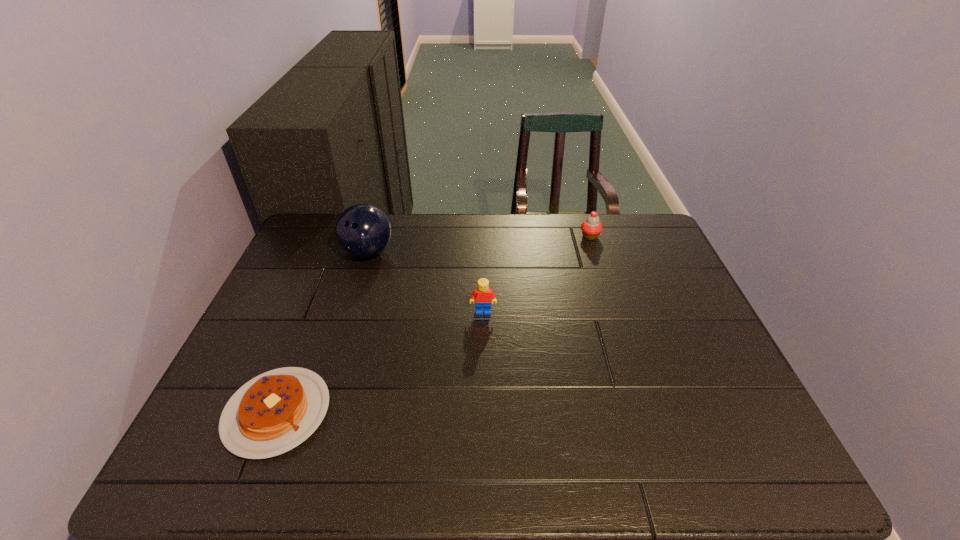
The width and height of the screenshot is (960, 540). Find the location of `free point located on the right of the shortest object`. free point located on the right of the shortest object is located at coordinates (438, 412).

Locate an element on the screen. This screenshot has width=960, height=540. bowling ball that is at the far edge is located at coordinates (362, 230).

Find the location of a particular element. The width and height of the screenshot is (960, 540). cupcake that is at the far edge is located at coordinates (591, 228).

Find the location of `object positioned at the near edge`. object positioned at the near edge is located at coordinates (274, 412).

The width and height of the screenshot is (960, 540). What are the coordinates of `bowling ball that is at the left edge` in the screenshot? It's located at (362, 230).

This screenshot has height=540, width=960. Find the location of `pancake at the left edge`. pancake at the left edge is located at coordinates (274, 412).

What are the coordinates of `object that is positioned at the far left corner` in the screenshot? It's located at (362, 230).

Locate an element on the screen. This screenshot has width=960, height=540. object that is at the near left corner is located at coordinates (274, 412).

What are the coordinates of `vacant point at the far edge` in the screenshot? It's located at (592, 250).

Where is `vacant space at the left edge of the desktop`? The width and height of the screenshot is (960, 540). vacant space at the left edge of the desktop is located at coordinates (301, 328).